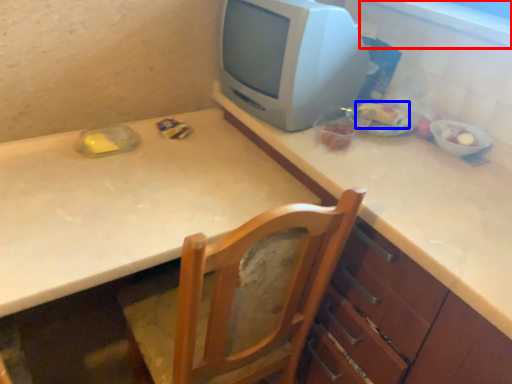
Question: Which of the following is the farthest to the observer, window sill (highlighted by a red box) or food (highlighted by a blue box)?

Choices:
 (A) window sill
 (B) food

Answer: (B)